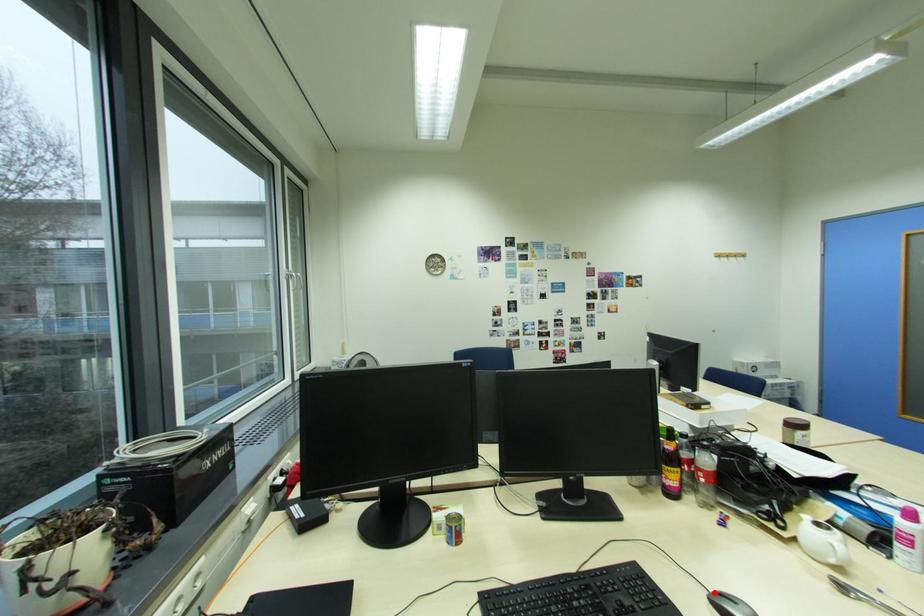
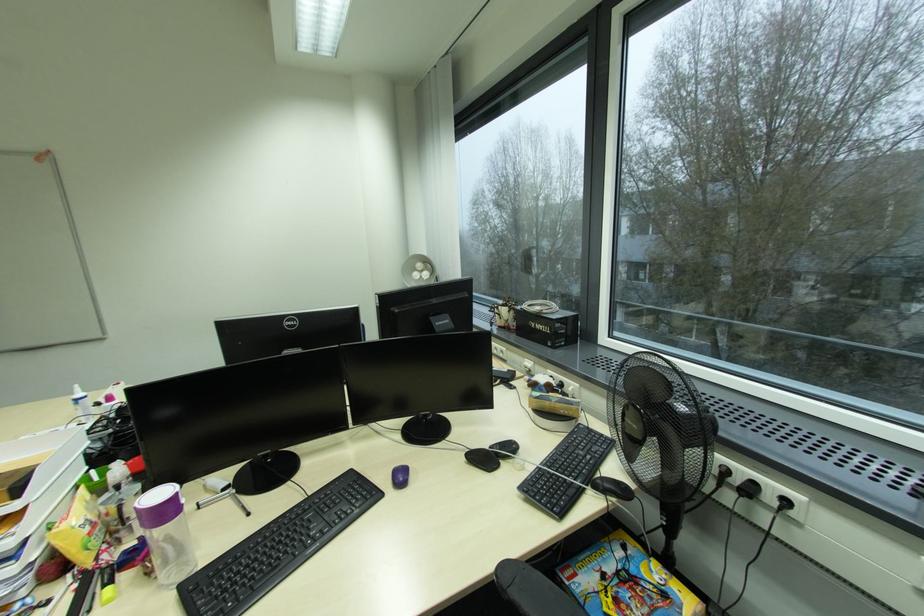
Question: I am providing you with two images of the same scene from different viewpoints. A red point is marked on the first image. Can you still see the location of the red point in image 2?

Choices:
 (A) Yes
 (B) No

Answer: (B)